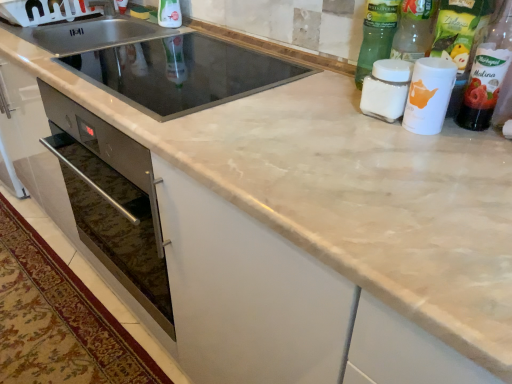
What is the approximate height of transparent plastic bottle at upper center, which appears as the 6th bottle when viewed from the right?

transparent plastic bottle at upper center, which appears as the 6th bottle when viewed from the right, is 9.83 inches in height.

Where is `stainless steel sink at upper left, which ranks as the second sink in front-to-back order`? stainless steel sink at upper left, which ranks as the second sink in front-to-back order is located at coordinates (90, 34).

Find the location of a particular element. white matte cup at upper right, which ranks as the 3th bottle in right-to-left order is located at coordinates (429, 95).

Where is `white matte jar at upper right, positioned as the fifth bottle in right-to-left order`? white matte jar at upper right, positioned as the fifth bottle in right-to-left order is located at coordinates (386, 89).

At what (x,y) coordinates should I click in order to perform the action: click on black glass sink at center, positioned as the 2th sink in back-to-front order. Please return your answer as a coordinate pair (x, y). This screenshot has width=512, height=384. Looking at the image, I should click on (161, 64).

Between green glass bottle at upper right, positioned as the fourth bottle in right-to-left order, and white plastic cup at upper right, the second bottle positioned from the right, which one has larger size?

Bigger between the two is green glass bottle at upper right, positioned as the fourth bottle in right-to-left order.

Is point (387, 15) closer or farther from the camera than point (479, 28)?

Clearly, point (387, 15) is more distant from the camera than point (479, 28).

Does green glass bottle at upper right, positioned as the fourth bottle in right-to-left order, have a greater height compared to white plastic cup at upper right, which is the 5th bottle in left-to-right order?

Yes, green glass bottle at upper right, positioned as the fourth bottle in right-to-left order, is taller than white plastic cup at upper right, which is the 5th bottle in left-to-right order.

From the image's perspective, which one is positioned higher, green glass bottle at upper right, the 3th bottle positioned from the left, or white plastic cup at upper right, the second bottle positioned from the right?

green glass bottle at upper right, the 3th bottle positioned from the left, is shown above in the image.

Looking at this image, can green glass bottle at upper right, the 3th bottle positioned from the left, be found inside white matte cup at upper right, marked as the 4th bottle in a left-to-right arrangement?

No, green glass bottle at upper right, the 3th bottle positioned from the left, is not inside white matte cup at upper right, marked as the 4th bottle in a left-to-right arrangement.

From a real-world perspective, does white matte cup at upper right, marked as the 4th bottle in a left-to-right arrangement, sit lower than green glass bottle at upper right, positioned as the fourth bottle in right-to-left order?

Correct, in the physical world, white matte cup at upper right, marked as the 4th bottle in a left-to-right arrangement, is lower than green glass bottle at upper right, positioned as the fourth bottle in right-to-left order.

Is white matte cup at upper right, which ranks as the 3th bottle in right-to-left order, wider than green glass bottle at upper right, positioned as the fourth bottle in right-to-left order?

No.

Find the location of a particular element. This screenshot has width=512, height=384. sink above the black glass sink at center, positioned as the 2th sink in back-to-front order (from the image's perspective) is located at coordinates (90, 34).

Considering the relative sizes of stainless steel sink at upper left, which ranks as the second sink in front-to-back order, and black glass sink at center, the first sink in the front-to-back sequence, in the image provided, is stainless steel sink at upper left, which ranks as the second sink in front-to-back order, thinner than black glass sink at center, the first sink in the front-to-back sequence,?

Yes, stainless steel sink at upper left, which ranks as the second sink in front-to-back order, is thinner than black glass sink at center, the first sink in the front-to-back sequence.

Could you tell me if stainless steel sink at upper left, the first sink positioned from the back, is turned towards black glass sink at center, positioned as the 2th sink in back-to-front order?

No, stainless steel sink at upper left, the first sink positioned from the back, is not aimed at black glass sink at center, positioned as the 2th sink in back-to-front order.

Is black glass sink at center, the first sink in the front-to-back sequence, completely or partially inside stainless steel sink at upper left, the first sink positioned from the back?

No, black glass sink at center, the first sink in the front-to-back sequence, is not surrounded by stainless steel sink at upper left, the first sink positioned from the back.

What's the angular difference between transparent plastic bottle at upper center, the first bottle when ordered from left to right, and white matte cup at upper right, marked as the 4th bottle in a left-to-right arrangement,'s facing directions?

transparent plastic bottle at upper center, the first bottle when ordered from left to right, and white matte cup at upper right, marked as the 4th bottle in a left-to-right arrangement, are facing 0.344 degrees away from each other.

Based on the photo, which is closer, (173,21) or (433,103)?

Point (173,21) is farther from the camera than point (433,103).

Does transparent plastic bottle at upper center, which appears as the 6th bottle when viewed from the right, have a smaller size compared to white matte cup at upper right, which ranks as the 3th bottle in right-to-left order?

No.

From the image's perspective, is transparent plastic bottle at upper center, the first bottle when ordered from left to right, on white matte cup at upper right, marked as the 4th bottle in a left-to-right arrangement?

Yes, from the image's perspective, transparent plastic bottle at upper center, the first bottle when ordered from left to right, is on top of white matte cup at upper right, marked as the 4th bottle in a left-to-right arrangement.

Looking at this image, is white matte jar at upper right, positioned as the fifth bottle in right-to-left order, turned away from white plastic cup at upper right, which is the 5th bottle in left-to-right order?

Yes.

From the image's perspective, which is below, white matte jar at upper right, positioned as the fifth bottle in right-to-left order, or white plastic cup at upper right, the second bottle positioned from the right?

white matte jar at upper right, positioned as the fifth bottle in right-to-left order, appears lower in the image.

Consider the image. Who is more distant, white matte jar at upper right, arranged as the second bottle when viewed from the left, or white plastic cup at upper right, the second bottle positioned from the right?

white matte jar at upper right, arranged as the second bottle when viewed from the left, is more distant.

Consider the image. How many degrees apart are the facing directions of white matte jar at upper right, arranged as the second bottle when viewed from the left, and white plastic cup at upper right, the second bottle positioned from the right?

0.00324 degrees.

Which point is more forward, (470, 8) or (61, 46)?

The point (470, 8) is in front.

From their relative heights in the image, would you say white plastic cup at upper right, the second bottle positioned from the right, is taller or shorter than stainless steel sink at upper left, which ranks as the second sink in front-to-back order?

white plastic cup at upper right, the second bottle positioned from the right, is taller than stainless steel sink at upper left, which ranks as the second sink in front-to-back order.

Is white plastic cup at upper right, which is the 5th bottle in left-to-right order, smaller than stainless steel sink at upper left, which ranks as the second sink in front-to-back order?

Yes, white plastic cup at upper right, which is the 5th bottle in left-to-right order, is smaller than stainless steel sink at upper left, which ranks as the second sink in front-to-back order.

Considering the positions of point (148, 30) and point (495, 88), is point (148, 30) closer or farther from the camera than point (495, 88)?

Point (148, 30).

In the scene shown: From their relative heights in the image, would you say stainless steel sink at upper left, the first sink positioned from the back, is taller or shorter than translucent plastic bottle at upper right, which is the 1th bottle from right to left?

Considering their sizes, stainless steel sink at upper left, the first sink positioned from the back, has less height than translucent plastic bottle at upper right, which is the 1th bottle from right to left.

Considering the sizes of stainless steel sink at upper left, which ranks as the second sink in front-to-back order, and translucent plastic bottle at upper right, which is the 1th bottle from right to left, in the image, is stainless steel sink at upper left, which ranks as the second sink in front-to-back order, wider or thinner than translucent plastic bottle at upper right, which is the 1th bottle from right to left,?

Clearly, stainless steel sink at upper left, which ranks as the second sink in front-to-back order, has more width compared to translucent plastic bottle at upper right, which is the 1th bottle from right to left.

Find the location of a particular element. bottle that is the 2nd one when counting forward from the green glass bottle at upper right, the 3th bottle positioned from the left is located at coordinates 459,38.

Which bottle is the 1st one when counting from the left side of the white matte cup at upper right, which ranks as the 3th bottle in right-to-left order? Please provide its 2D coordinates.

[(376, 35)]

Looking at the image, which one is located further to green glass bottle at upper right, the 3th bottle positioned from the left, white matte jar at upper right, arranged as the second bottle when viewed from the left, or white matte cup at upper right, marked as the 4th bottle in a left-to-right arrangement?

white matte cup at upper right, marked as the 4th bottle in a left-to-right arrangement, is further to green glass bottle at upper right, the 3th bottle positioned from the left.

Based on their spatial positions, is white matte cup at upper right, which ranks as the 3th bottle in right-to-left order, or translucent plastic bottle at upper right, placed as the sixth bottle when sorted from left to right, further from stainless steel sink at upper left, the first sink positioned from the back?

The object further to stainless steel sink at upper left, the first sink positioned from the back, is translucent plastic bottle at upper right, placed as the sixth bottle when sorted from left to right.

Based on their spatial positions, is translucent plastic bottle at upper right, placed as the sixth bottle when sorted from left to right, or transparent plastic bottle at upper center, which appears as the 6th bottle when viewed from the right, closer to black glass sink at center, the first sink in the front-to-back sequence?

transparent plastic bottle at upper center, which appears as the 6th bottle when viewed from the right.

Looking at this image, estimate the real-world distances between objects in this image. Which object is further from stainless steel sink at upper left, the first sink positioned from the back, black glass sink at center, the first sink in the front-to-back sequence, or green glass bottle at upper right, the 3th bottle positioned from the left?

The object further to stainless steel sink at upper left, the first sink positioned from the back, is green glass bottle at upper right, the 3th bottle positioned from the left.

Estimate the real-world distances between objects in this image. Which object is closer to translucent plastic bottle at upper right, which is the 1th bottle from right to left, green glass bottle at upper right, the 3th bottle positioned from the left, or black glass sink at center, positioned as the 2th sink in back-to-front order?

green glass bottle at upper right, the 3th bottle positioned from the left, lies closer to translucent plastic bottle at upper right, which is the 1th bottle from right to left, than the other object.

Which object lies nearer to the anchor point green glass bottle at upper right, the 3th bottle positioned from the left, white matte jar at upper right, arranged as the second bottle when viewed from the left, or white plastic cup at upper right, the second bottle positioned from the right?

Based on the image, white plastic cup at upper right, the second bottle positioned from the right, appears to be nearer to green glass bottle at upper right, the 3th bottle positioned from the left.

From the image, which object appears to be nearer to stainless steel sink at upper left, which ranks as the second sink in front-to-back order, transparent plastic bottle at upper center, the first bottle when ordered from left to right, or black glass sink at center, the first sink in the front-to-back sequence?

The object closer to stainless steel sink at upper left, which ranks as the second sink in front-to-back order, is black glass sink at center, the first sink in the front-to-back sequence.

Based on their spatial positions, is translucent plastic bottle at upper right, which is the 1th bottle from right to left, or white matte jar at upper right, arranged as the second bottle when viewed from the left, further from white matte cup at upper right, marked as the 4th bottle in a left-to-right arrangement?

translucent plastic bottle at upper right, which is the 1th bottle from right to left.

You are a GUI agent. You are given a task and a screenshot of the screen. Output one action in this format:
    pyautogui.click(x=<x>, y=<y>)
    Task: Click on the sink located between transparent plastic bottle at upper center, the first bottle when ordered from left to right, and green glass bottle at upper right, positioned as the fourth bottle in right-to-left order, in the left-right direction
    The height and width of the screenshot is (384, 512).
    Given the screenshot: What is the action you would take?
    [161, 64]

Identify the location of bottle between white matte cup at upper right, marked as the 4th bottle in a left-to-right arrangement, and translucent plastic bottle at upper right, placed as the sixth bottle when sorted from left to right, from left to right. (459, 38).

In order to click on sink situated between stainless steel sink at upper left, which ranks as the second sink in front-to-back order, and white matte cup at upper right, marked as the 4th bottle in a left-to-right arrangement, from left to right in this screenshot , I will do `click(161, 64)`.

Where is `sink between transparent plastic bottle at upper center, the first bottle when ordered from left to right, and white plastic cup at upper right, which is the 5th bottle in left-to-right order, in the horizontal direction`? This screenshot has width=512, height=384. sink between transparent plastic bottle at upper center, the first bottle when ordered from left to right, and white plastic cup at upper right, which is the 5th bottle in left-to-right order, in the horizontal direction is located at coordinates (161, 64).